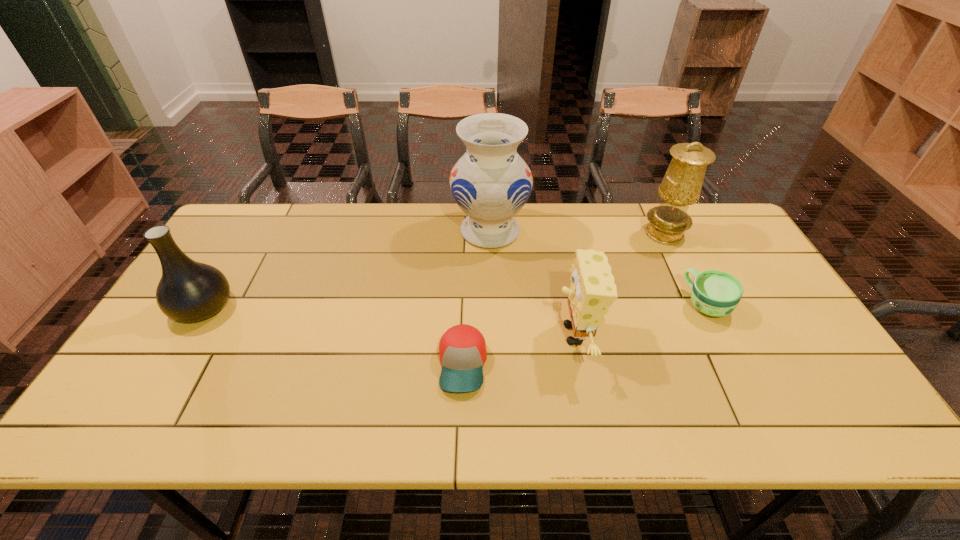
Where is `the farther vase`? the farther vase is located at coordinates (491, 183).

At what (x,y) coordinates should I click in order to perform the action: click on the taller vase. Please return your answer as a coordinate pair (x, y). This screenshot has width=960, height=540. Looking at the image, I should click on (491, 183).

At what (x,y) coordinates should I click in order to perform the action: click on oil lamp. Please return your answer as a coordinate pair (x, y). The image size is (960, 540). Looking at the image, I should click on (681, 186).

Where is `the left vase`? This screenshot has width=960, height=540. the left vase is located at coordinates (188, 291).

You are a GUI agent. You are given a task and a screenshot of the screen. Output one action in this format:
    pyautogui.click(x=<x>, y=<y>)
    Task: Click on the shorter vase
    
    Given the screenshot: What is the action you would take?
    pyautogui.click(x=188, y=291)

This screenshot has width=960, height=540. I want to click on sponge, so click(x=592, y=291).

Find the location of a particular element. This screenshot has height=540, width=960. cup is located at coordinates (715, 293).

Identify the location of the shortest object. This screenshot has width=960, height=540. (462, 349).

What are the coordinates of `vacant area situated on the front of the right vase` in the screenshot? It's located at (492, 272).

Find the location of a particular element. The height and width of the screenshot is (540, 960). free space located 0.320m on the left of the oil lamp is located at coordinates (544, 234).